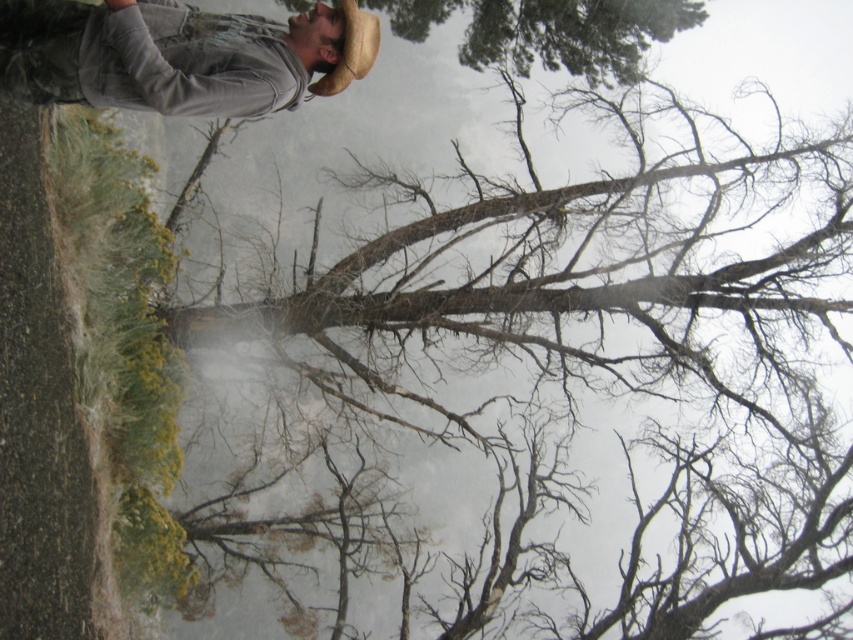
You are standing in a forest and want to take a photo of the bare branches at upper center. To ensure the branches are in focus, where should you aim your camera?

The bare branches at upper center are located at point (x=573, y=374), so aim your camera at that coordinate to focus on them.

You are a photographer trying to capture the braided straw cowboy hat at upper center and the bare branches at upper center in a single frame. Which object should you adjust your camera to focus on first if you want to ensure both are in the shot?

You should focus on the braided straw cowboy hat at upper center first because the bare branches at upper center is positioned on the right side of it, so adjusting the frame to include the hat will naturally include the branches as well.